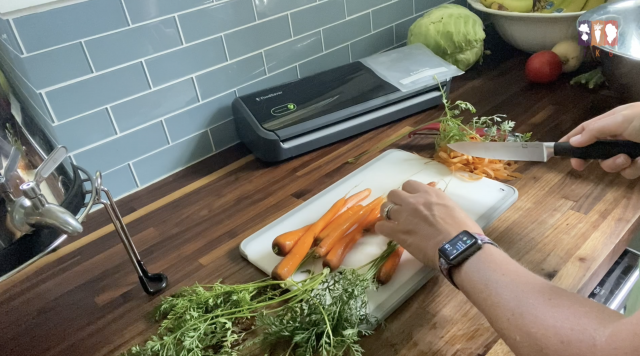
Where is `white chopping board`? Image resolution: width=640 pixels, height=356 pixels. white chopping board is located at coordinates (383, 172).